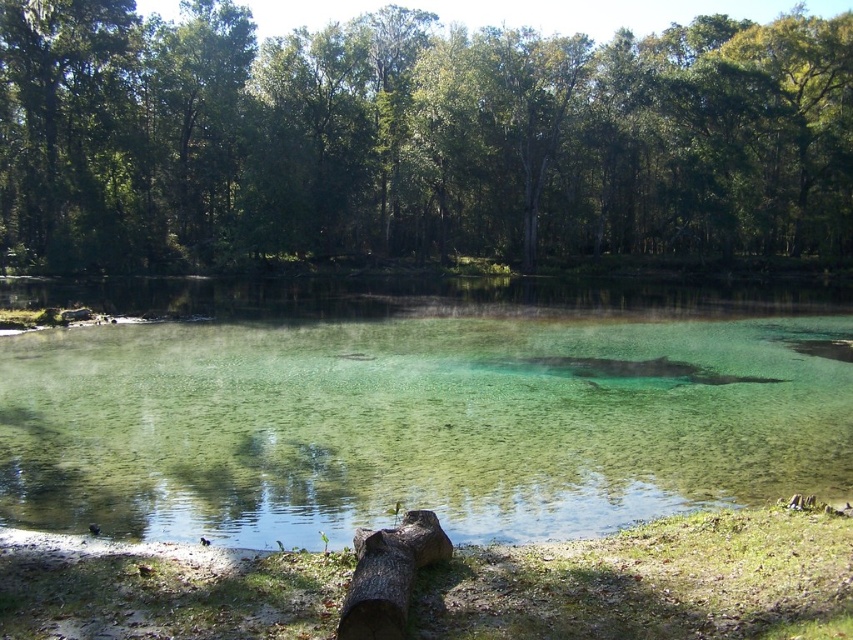
Question: Can you confirm if green leafy tree at center is thinner than brown rough tree trunk at lower center?

Choices:
 (A) no
 (B) yes

Answer: (A)

Question: Is clear water at center further to the viewer compared to brown rough tree trunk at lower center?

Choices:
 (A) no
 (B) yes

Answer: (B)

Question: Which point is farther to the camera?

Choices:
 (A) green leafy tree at center
 (B) brown rough tree trunk at lower center

Answer: (A)

Question: Which point is closer to the camera?

Choices:
 (A) (519, 56)
 (B) (397, 532)
 (C) (631, 449)

Answer: (B)

Question: Which point is closer to the camera taking this photo?

Choices:
 (A) (450, 552)
 (B) (376, 253)

Answer: (A)

Question: From the image, what is the correct spatial relationship of green leafy tree at center in relation to clear water at center?

Choices:
 (A) below
 (B) above

Answer: (B)